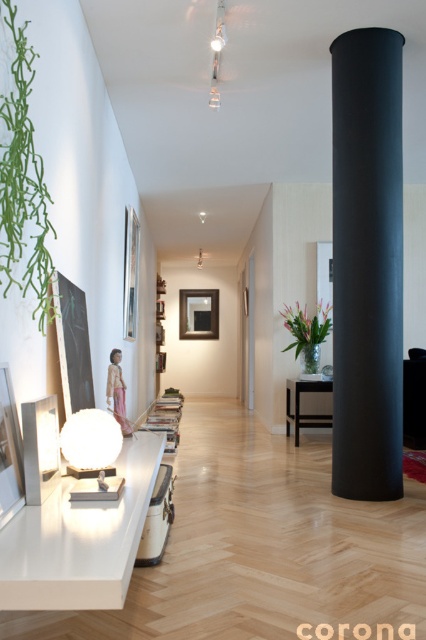
Question: Based on their relative distances, which object is nearer to the green matte plant at left?

Choices:
 (A) black matte cylinder at center
 (B) black wood table at center
 (C) translucent glass vase at center-right

Answer: (A)

Question: Considering the real-world distances, which object is closest to the black wood table at center?

Choices:
 (A) translucent glass vase at center-right
 (B) pink fabric at center

Answer: (A)

Question: Can you confirm if translucent glass vase at center-right is positioned to the left of black wood table at center?

Choices:
 (A) yes
 (B) no

Answer: (B)

Question: Which of the following is the closest to the observer?

Choices:
 (A) black matte cylinder at center
 (B) green matte plant at left
 (C) pink fabric at center
 (D) translucent glass vase at center-right

Answer: (B)

Question: Does translucent glass vase at center-right appear on the right side of pink fabric at center?

Choices:
 (A) no
 (B) yes

Answer: (B)

Question: Does black matte cylinder at center have a greater width compared to green matte plant at left?

Choices:
 (A) no
 (B) yes

Answer: (B)